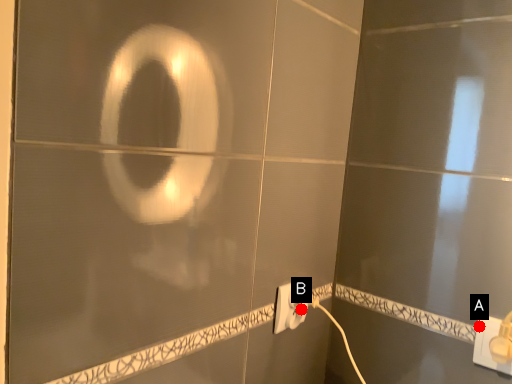
Question: Two points are circled on the image, labeled by A and B beside each circle. Which point appears farthest from the camera in this image?

Choices:
 (A) A is further
 (B) B is further

Answer: (B)